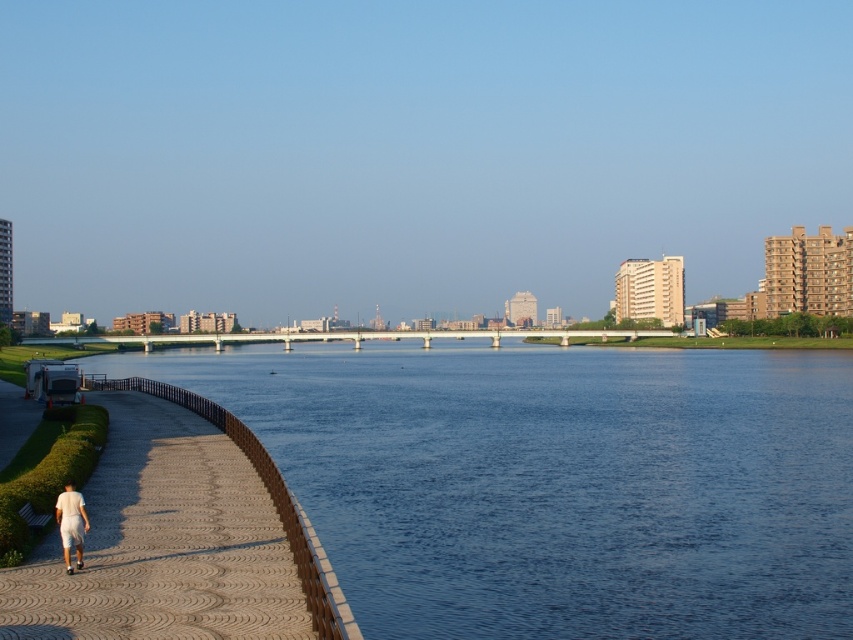
Is point (141, 472) less distant than point (67, 493)?

That is False.

Measure the distance between brown textured pavement at lower left and camera.

They are 12.15 meters apart.

The width and height of the screenshot is (853, 640). In order to click on brown textured pavement at lower left in this screenshot , I will do `click(177, 541)`.

Does blue water at center have a lesser height compared to brown textured pavement at lower left?

No.

Between blue water at center and brown textured pavement at lower left, which one is positioned lower?

brown textured pavement at lower left is below.

The image size is (853, 640). What do you see at coordinates (556, 483) in the screenshot?
I see `blue water at center` at bounding box center [556, 483].

Where is `blue water at center`? blue water at center is located at coordinates (556, 483).

Based on the photo, is blue water at center smaller than white cotton shorts at lower left?

No.

Does blue water at center appear on the right side of white cotton shorts at lower left?

Yes, blue water at center is to the right of white cotton shorts at lower left.

Who is more distant from viewer, (625, 580) or (55, 516)?

The point (625, 580) is more distant.

Locate an element on the screen. blue water at center is located at coordinates (556, 483).